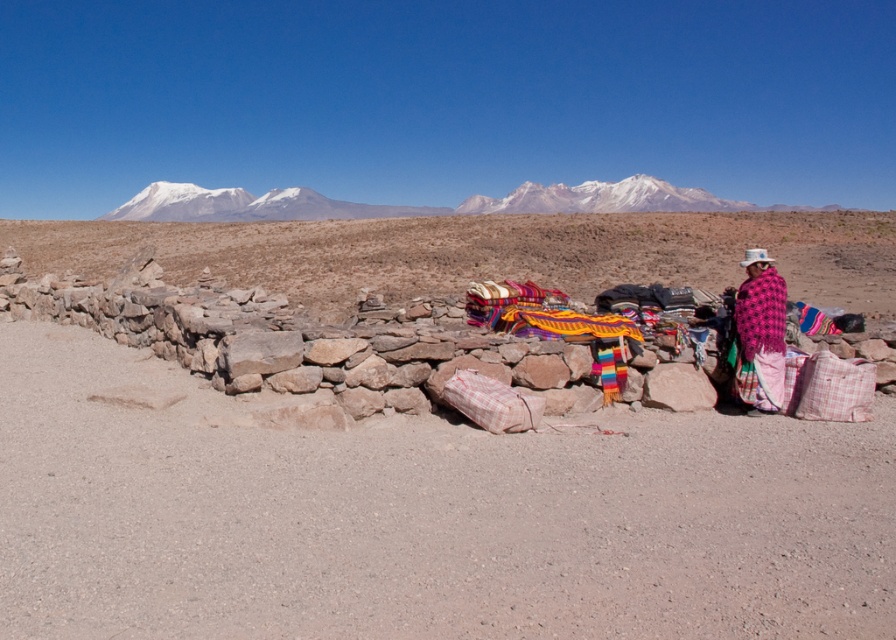
You are navigating a drone over the desert landscape shown in the image. The drone is currently at coordinates point A. You need to drop a package at the desert sand at center. What are the coordinates where you should release the package?

The coordinates for the desert sand at center are point (x=421, y=516), so you should release the package there.